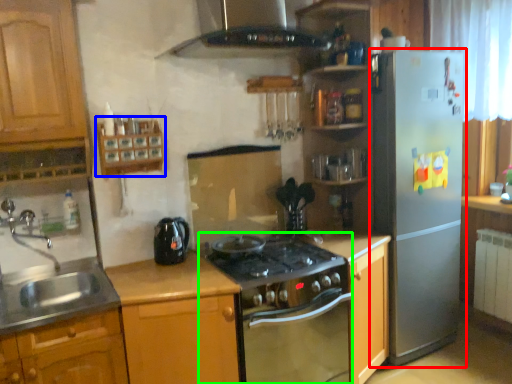
Question: Which object is positioned closest to refrigerator (highlighted by a red box)? Select from shelf (highlighted by a blue box) and oven (highlighted by a green box).

Choices:
 (A) shelf
 (B) oven

Answer: (B)